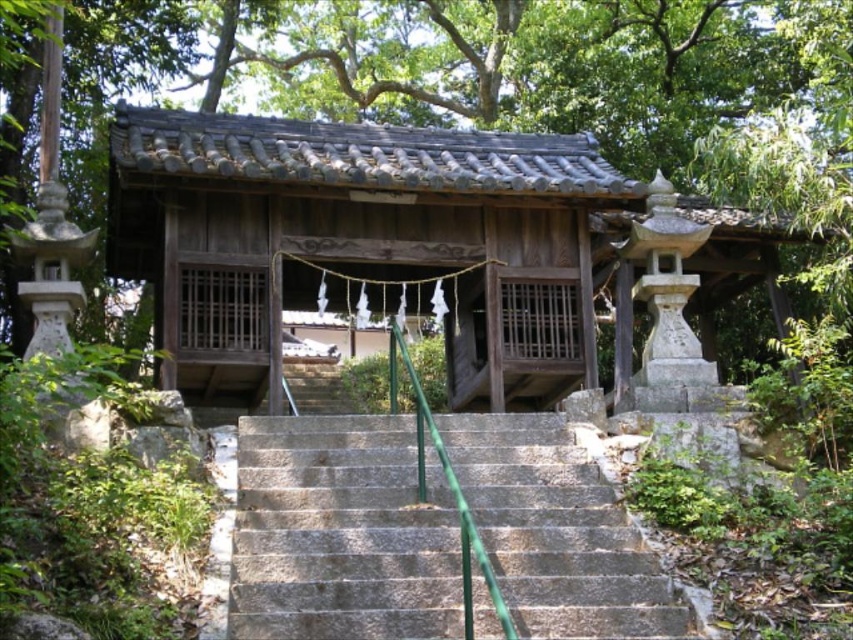
Question: Does gray stone stairs at center come behind green metallic handrail at center?

Choices:
 (A) yes
 (B) no

Answer: (A)

Question: Can you confirm if gray stone stairs at center is wider than green metallic handrail at center?

Choices:
 (A) no
 (B) yes

Answer: (B)

Question: Which object is farther from the camera taking this photo?

Choices:
 (A) green metallic handrail at center
 (B) gray stone stairs at center

Answer: (B)

Question: Observing the image, what is the correct spatial positioning of gray stone stairs at center in reference to green metallic handrail at center?

Choices:
 (A) left
 (B) right

Answer: (B)